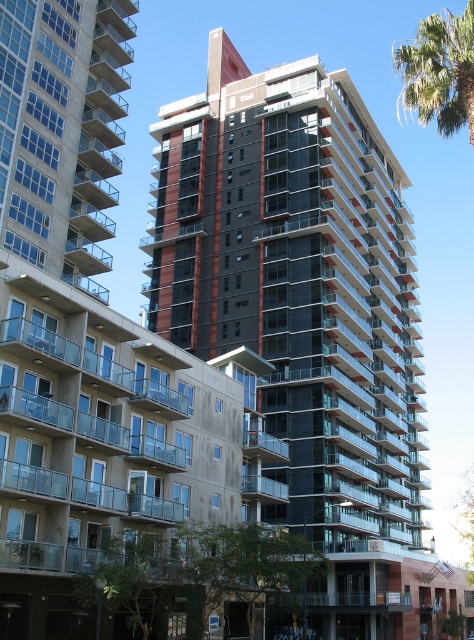
Which is more to the left, dark glass building at center or green leafy palm tree at upper right?

From the viewer's perspective, dark glass building at center appears more on the left side.

Can you confirm if dark glass building at center is smaller than green leafy palm tree at upper right?

Indeed, dark glass building at center has a smaller size compared to green leafy palm tree at upper right.

Does point (346, 378) lie in front of point (462, 108)?

No, (346, 378) is further to viewer.

Where is `dark glass building at center`? dark glass building at center is located at coordinates (299, 282).